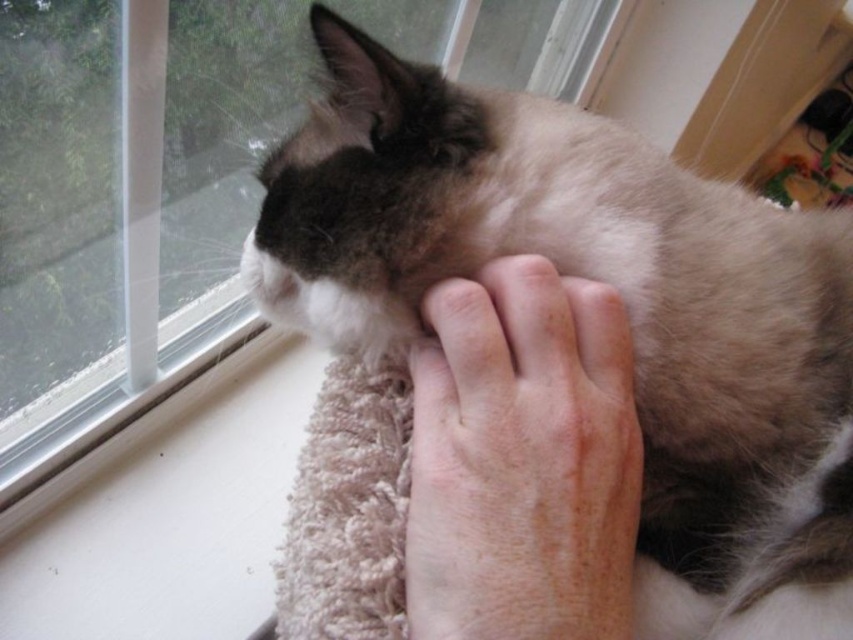
Who is shorter, dry skin at center or clear glass window at upper left?

With less height is dry skin at center.

Does point (589, 548) lie behind point (460, 36)?

No, (589, 548) is in front of (460, 36).

This screenshot has height=640, width=853. What are the coordinates of `dry skin at center` in the screenshot? It's located at (521, 460).